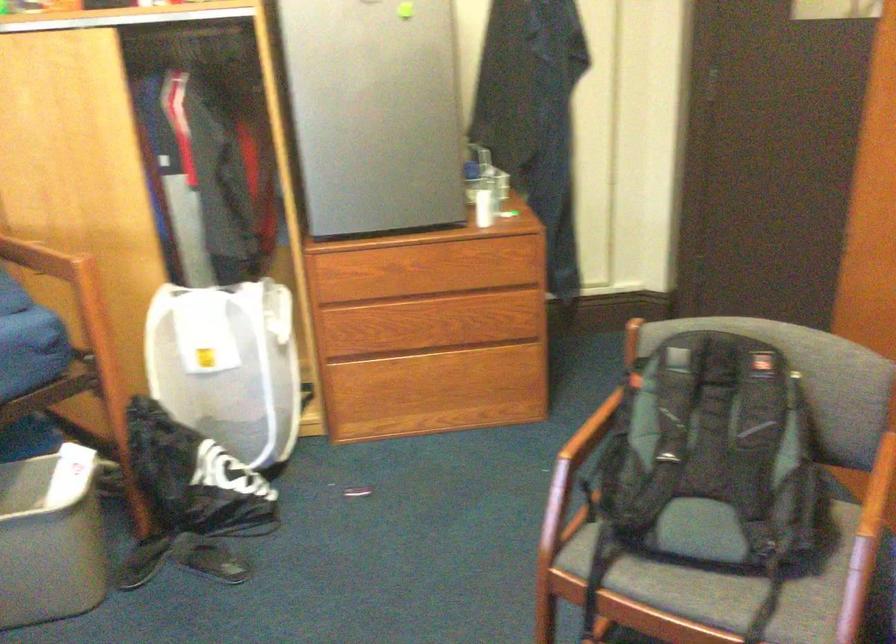
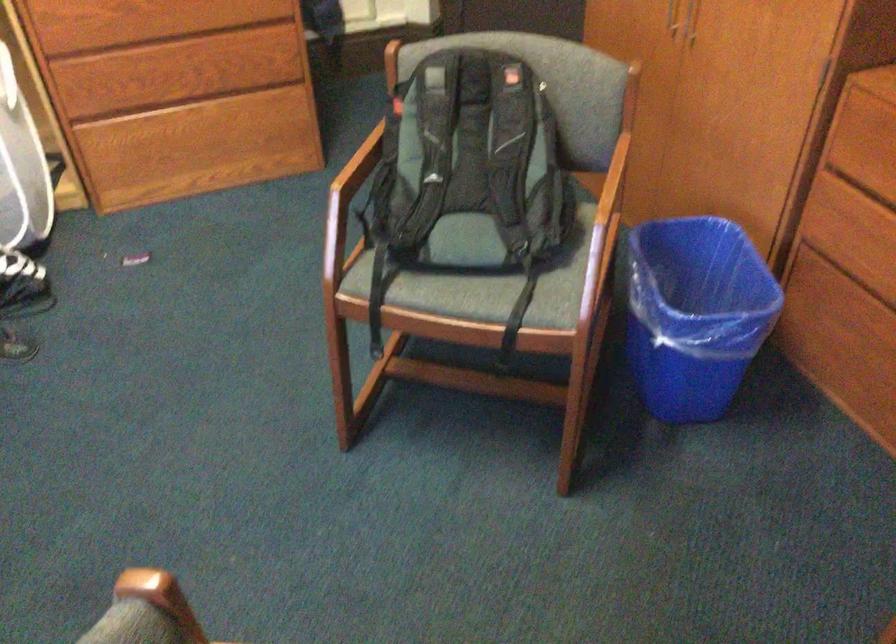
The point at [417,278] is marked in the first image. Where is the corresponding point in the second image?

(160, 20)